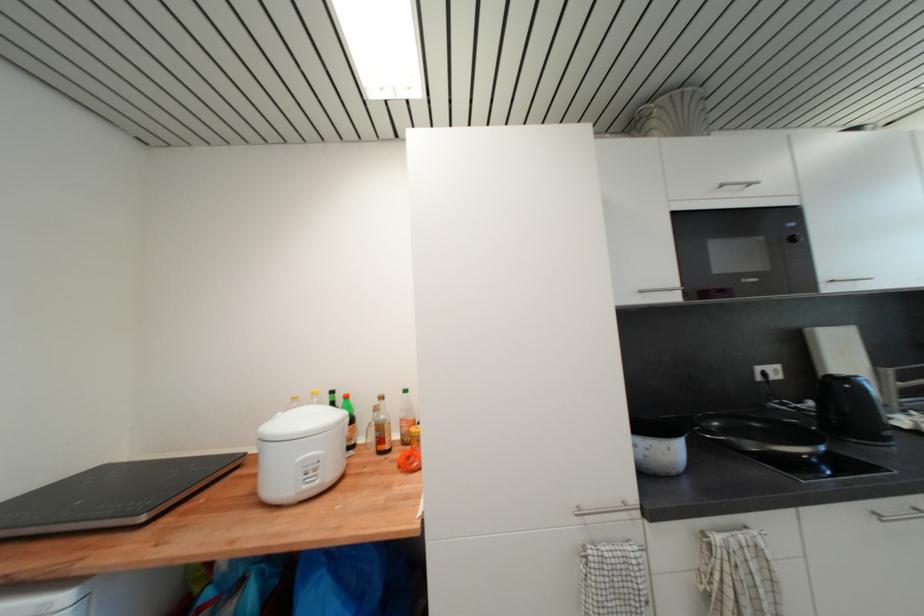
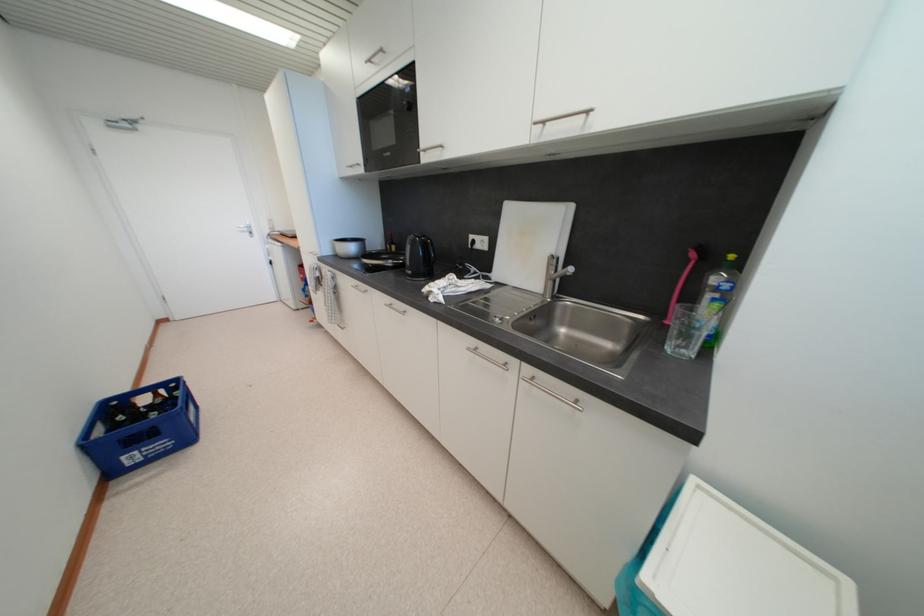
Find the pixel in the second image that matches (726,188) in the first image.

(375, 63)